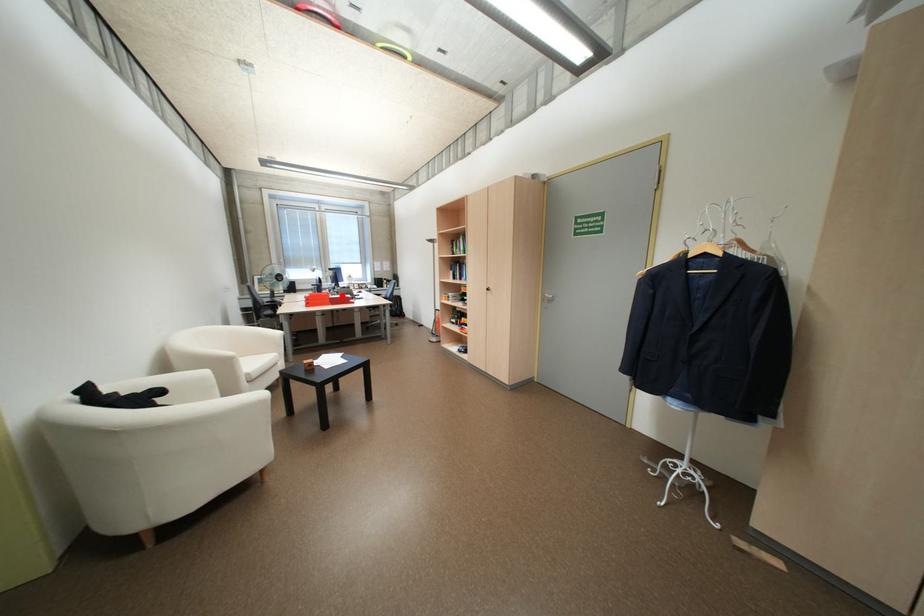
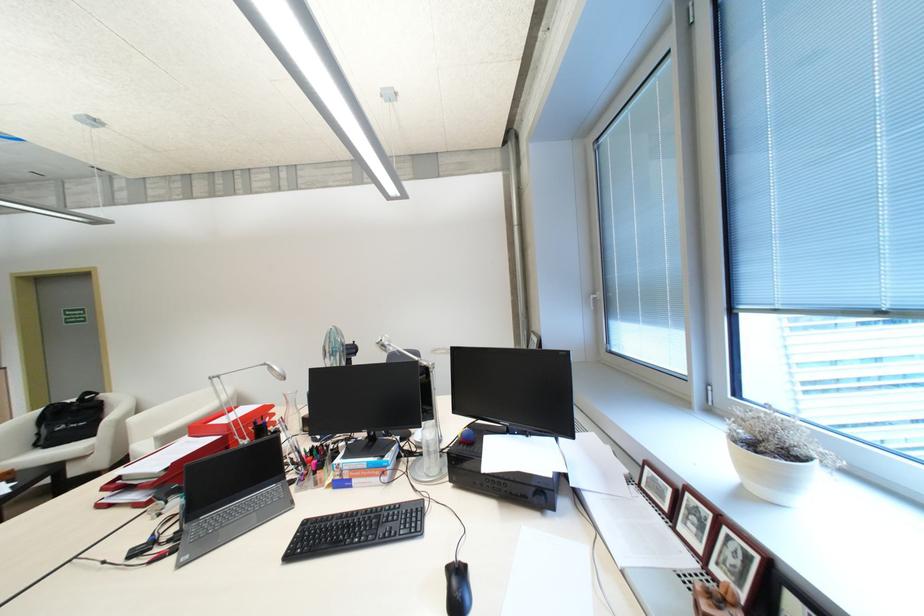
Question: A red point is marked in image1. In image2, is the corresponding 3D point closer to the camera or farther? Reply with the corresponding letter.

Choices:
 (A) The corresponding 3D point is closer.
 (B) The corresponding 3D point is farther.

Answer: (B)